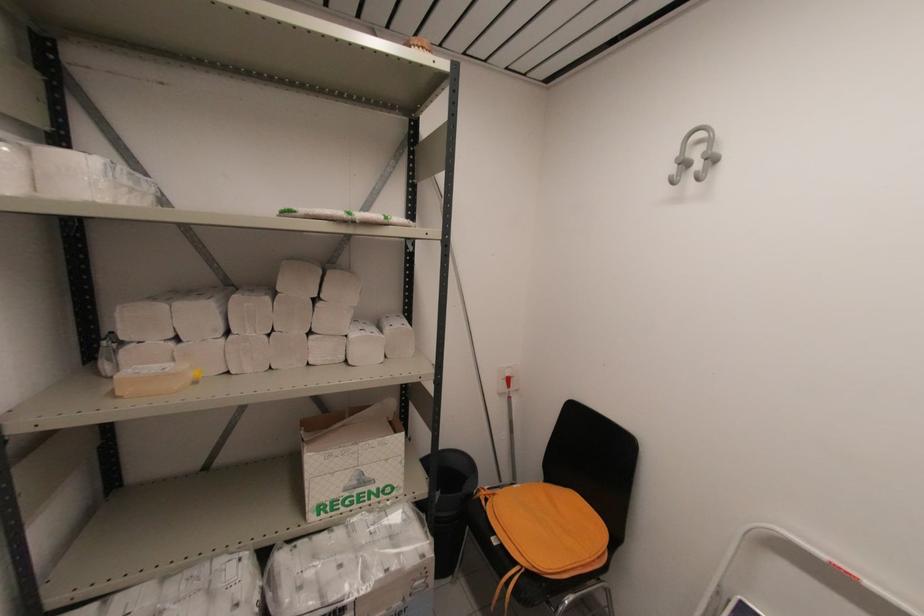
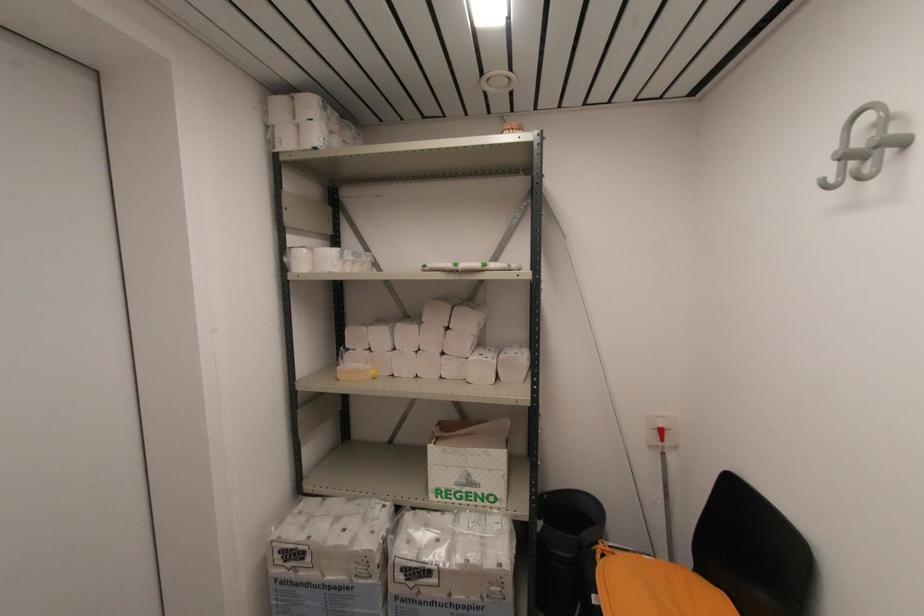
In the second image, find the point that corresponds to [438,501] in the first image.

(540, 530)